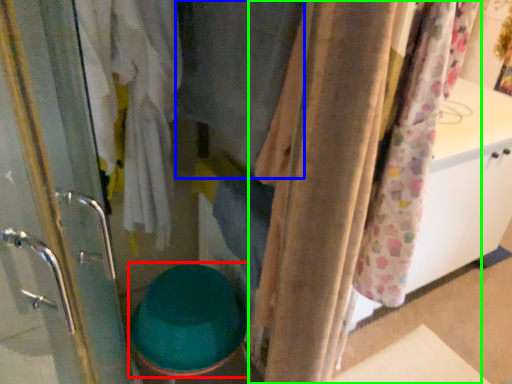
Question: Estimate the real-world distances between objects in this image. Which object is farther from toilet bowl (highlighted by a red box), clothing (highlighted by a blue box) or curtain (highlighted by a green box)?

Choices:
 (A) clothing
 (B) curtain

Answer: (A)